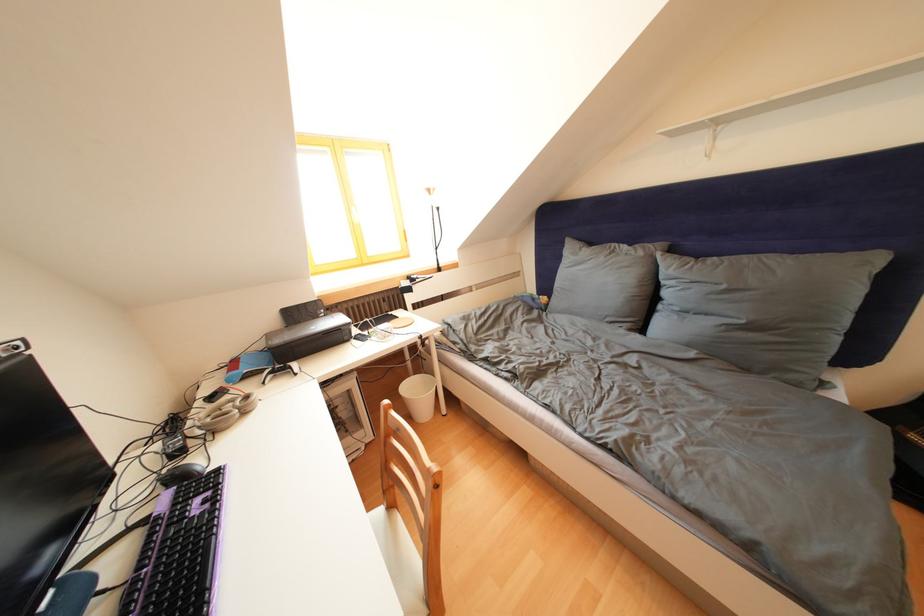
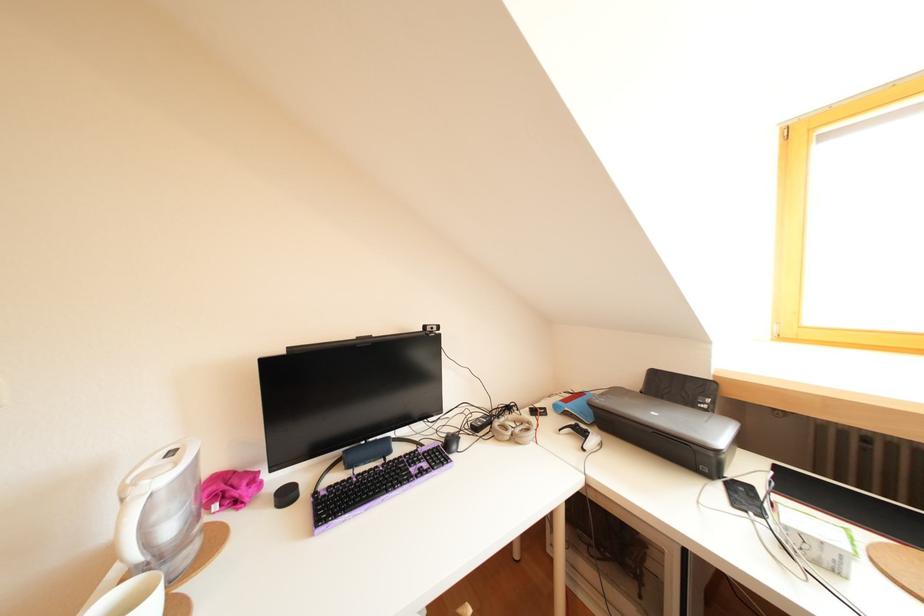
Find the pixel in the second image that matches pixel 360 346 in the first image.

(727, 490)